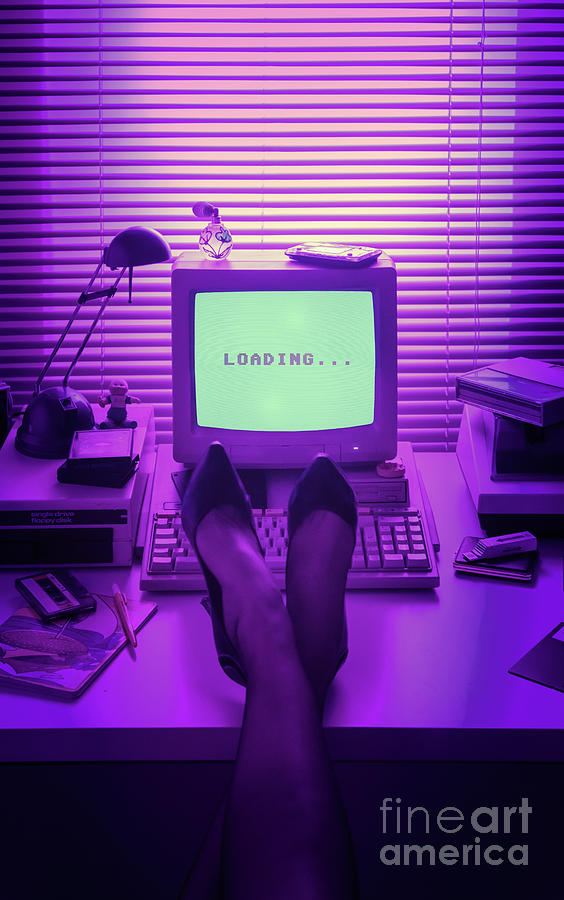
Identify the location of light shining through blinds light purple. The image size is (564, 900). (241, 79), (332, 97).